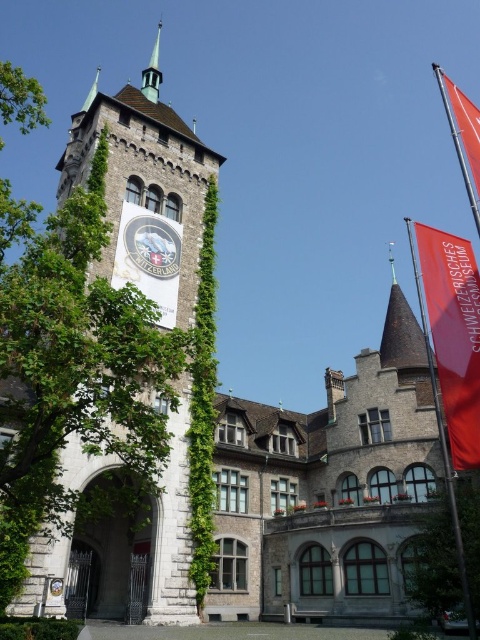
You are a tourist standing in front of the historic building. You notice the stone clock tower at left and the metallic flag pole at upper right. Which object appears larger in the image?

The stone clock tower at left has a smaller size compared to metallic flag pole at upper right, so the metallic flag pole at upper right appears larger in the image.